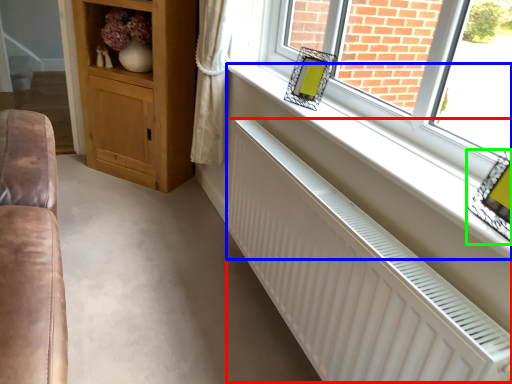
Question: Which object is the closest to the radiator (highlighted by a red box)? Choose among these: window sill (highlighted by a blue box) or picture frame (highlighted by a green box).

Choices:
 (A) window sill
 (B) picture frame

Answer: (A)